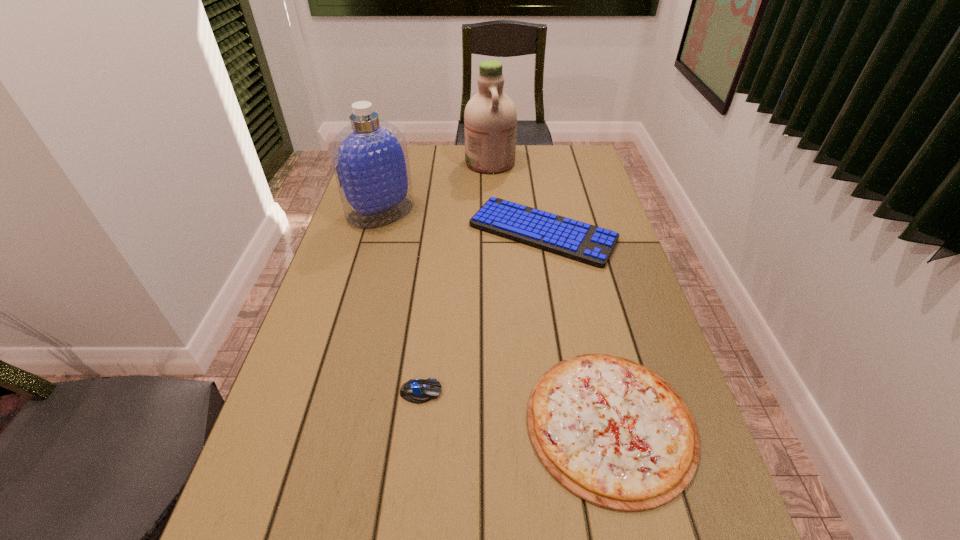
Find the location of a particular element. vacant space situated 0.090m on the front of the left cleansing agent is located at coordinates (370, 250).

This screenshot has height=540, width=960. I want to click on blank space located 0.360m on the back of the computer keyboard, so click(x=528, y=150).

Locate an element on the screen. The width and height of the screenshot is (960, 540). vacant space located 0.200m on the button side of the computer mouse is located at coordinates (538, 392).

Identify the location of vacant region located 0.240m on the left of the pizza. Image resolution: width=960 pixels, height=540 pixels. (406, 423).

What are the coordinates of `object located in the far edge section of the desktop` in the screenshot? It's located at (490, 118).

I want to click on object situated at the left edge, so click(x=370, y=160).

At what (x,y) coordinates should I click in order to perform the action: click on computer keyboard at the right edge. Please return your answer as a coordinate pair (x, y). This screenshot has height=540, width=960. Looking at the image, I should click on (579, 241).

Image resolution: width=960 pixels, height=540 pixels. What are the coordinates of `pizza located in the right edge section of the desktop` in the screenshot? It's located at (614, 433).

The height and width of the screenshot is (540, 960). In the image, there is a desktop. What are the coordinates of `vacant space at the far edge` in the screenshot? It's located at (438, 157).

Find the location of a particular element. Image resolution: width=960 pixels, height=540 pixels. free space at the left edge is located at coordinates (326, 498).